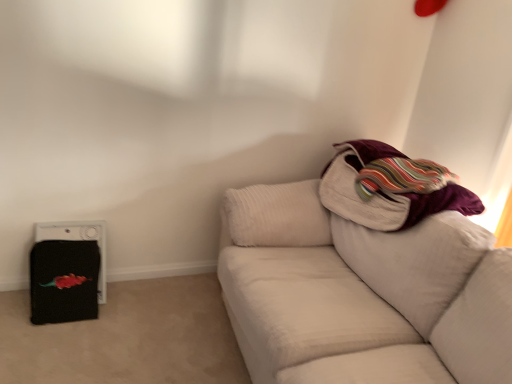
Question: Is white textured couch at right at the right side of velvet purple blanket at upper right?

Choices:
 (A) no
 (B) yes

Answer: (A)

Question: Is white textured couch at right thinner than velvet purple blanket at upper right?

Choices:
 (A) yes
 (B) no

Answer: (B)

Question: Is white textured couch at right taller than velvet purple blanket at upper right?

Choices:
 (A) yes
 (B) no

Answer: (A)

Question: Is white textured couch at right beside velvet purple blanket at upper right?

Choices:
 (A) no
 (B) yes

Answer: (A)

Question: Is white textured couch at right positioned in front of velvet purple blanket at upper right?

Choices:
 (A) yes
 (B) no

Answer: (A)

Question: Considering their positions, is black fabric at left located in front of or behind white textured couch at right?

Choices:
 (A) front
 (B) behind

Answer: (B)

Question: Choose the correct answer: Is black fabric at left inside white textured couch at right or outside it?

Choices:
 (A) outside
 (B) inside

Answer: (A)

Question: From a real-world perspective, is black fabric at left positioned above or below white textured couch at right?

Choices:
 (A) above
 (B) below

Answer: (B)

Question: Considering the positions of point (36, 241) and point (409, 311), is point (36, 241) closer or farther from the camera than point (409, 311)?

Choices:
 (A) farther
 (B) closer

Answer: (A)

Question: From a real-world perspective, is black fabric at left physically located above or below velvet purple blanket at upper right?

Choices:
 (A) below
 (B) above

Answer: (A)

Question: Relative to velvet purple blanket at upper right, is black fabric at left in front or behind?

Choices:
 (A) front
 (B) behind

Answer: (B)

Question: Looking at the image, does black fabric at left seem bigger or smaller compared to velvet purple blanket at upper right?

Choices:
 (A) big
 (B) small

Answer: (B)

Question: Considering the positions of point (76, 238) and point (443, 190), is point (76, 238) closer or farther from the camera than point (443, 190)?

Choices:
 (A) farther
 (B) closer

Answer: (A)

Question: Is velvet purple blanket at upper right situated inside black fabric at left or outside?

Choices:
 (A) outside
 (B) inside

Answer: (A)

Question: Relative to black fabric at left, is velvet purple blanket at upper right in front or behind?

Choices:
 (A) front
 (B) behind

Answer: (A)